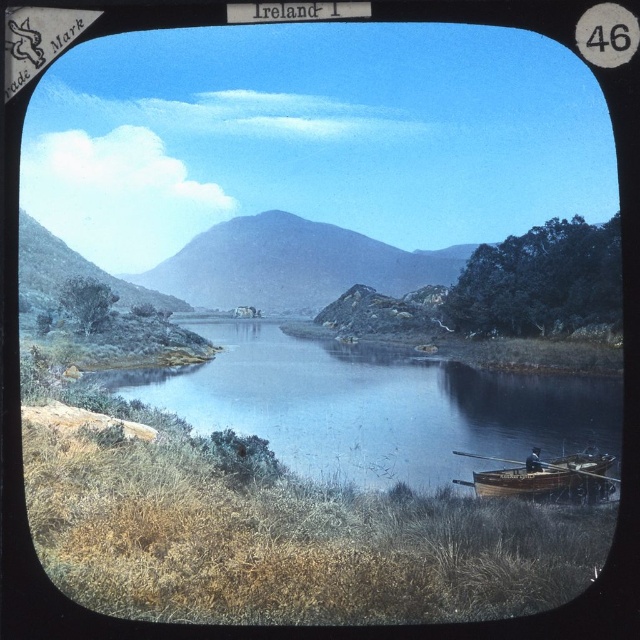
Question: Which object is closer to the camera taking this photo?

Choices:
 (A) wooden canoe at lower right
 (B) blue smooth water at center

Answer: (B)

Question: Is blue smooth water at center thinner than wooden canoe at lower right?

Choices:
 (A) yes
 (B) no

Answer: (B)

Question: Which point is farther to the camera?

Choices:
 (A) blue smooth water at center
 (B) wooden canoe at lower right

Answer: (B)

Question: Is blue smooth water at center to the left of wooden canoe at lower right from the viewer's perspective?

Choices:
 (A) no
 (B) yes

Answer: (B)

Question: Observing the image, what is the correct spatial positioning of blue smooth water at center in reference to wooden canoe at lower right?

Choices:
 (A) below
 (B) above

Answer: (B)